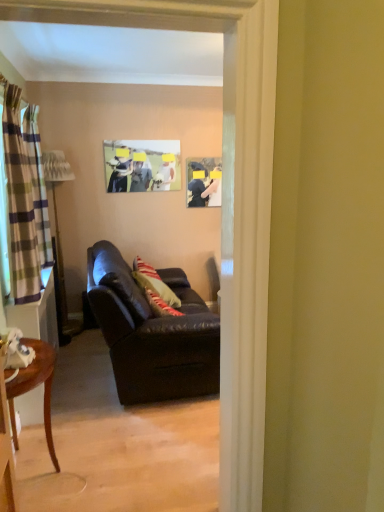
Locate an element on the screen. Image resolution: width=384 pixels, height=512 pixels. free location to the right of mahogany wood side table at lower left is located at coordinates (114, 460).